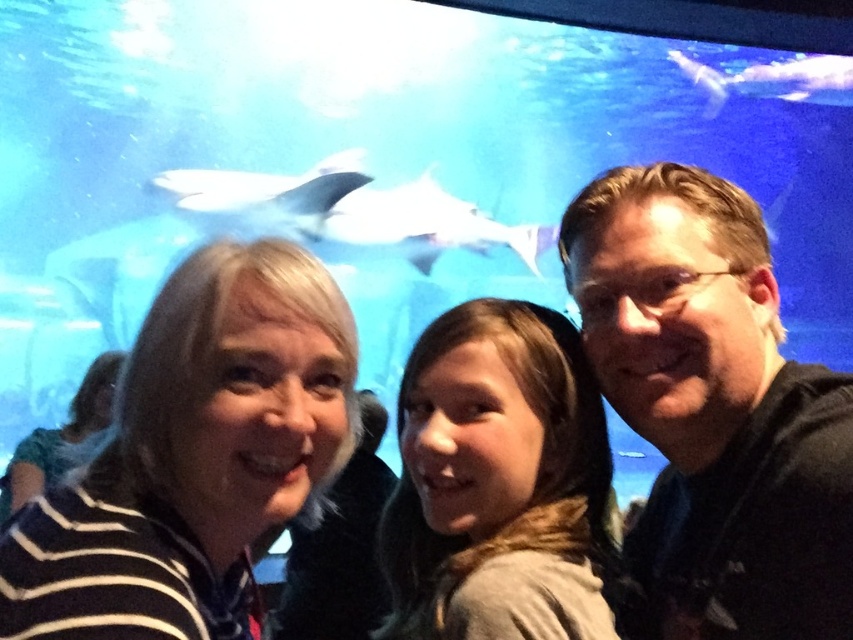
You are standing in front of an aquarium tank with a striped fabric at left and a white glossy shark at upper center. Which object is located higher in the image?

The white glossy shark at upper center is higher in the image than the striped fabric at left.

You are a photographer trying to capture a clear shot of the white matte shark at upper center without the striped fabric at left blocking the view. Based on their positions, can you achieve this?

Yes, because the white matte shark at upper center is closer to you than the striped fabric at left, so it will not block the view.

You are standing in front of the aquarium tank and see the white matte shark at upper center and the striped fabric at left. Which object is closer to you?

The striped fabric at left is closer to you because it is positioned below the white matte shark at upper center, which is further away.